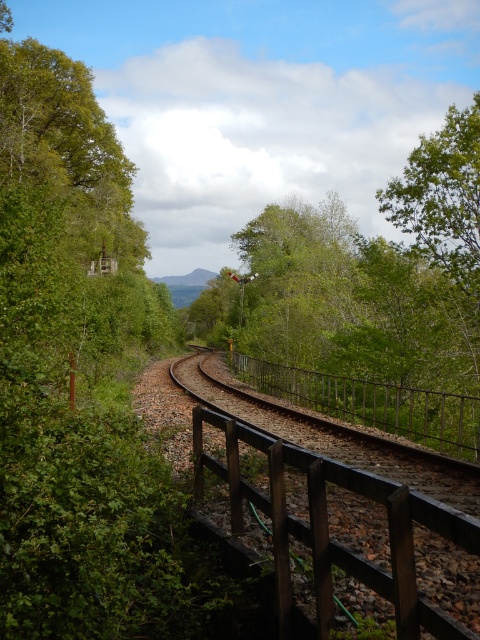
Question: Which of the following is the closest to the observer?

Choices:
 (A) brown wooden fence at center
 (B) black metal rail at center

Answer: (A)

Question: Is brown wooden fence at center to the left of black metal rail at center from the viewer's perspective?

Choices:
 (A) yes
 (B) no

Answer: (A)

Question: Can you confirm if brown wooden fence at center is thinner than black metal rail at center?

Choices:
 (A) no
 (B) yes

Answer: (B)

Question: Does brown wooden fence at center appear on the left side of black metal rail at center?

Choices:
 (A) no
 (B) yes

Answer: (B)

Question: Which point is farther to the camera?

Choices:
 (A) (429, 525)
 (B) (312, 388)

Answer: (B)